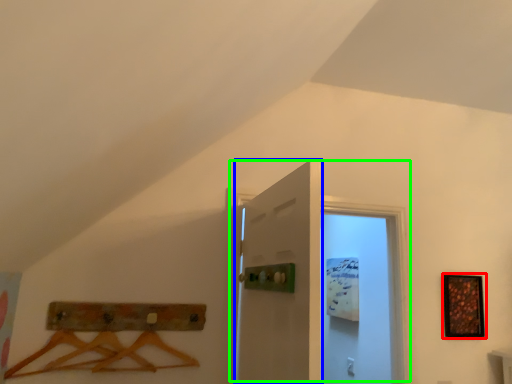
Question: Which object is positioned closest to picture frame (highlighted by a red box)? Select from door (highlighted by a blue box) and door (highlighted by a green box).

Choices:
 (A) door
 (B) door

Answer: (B)